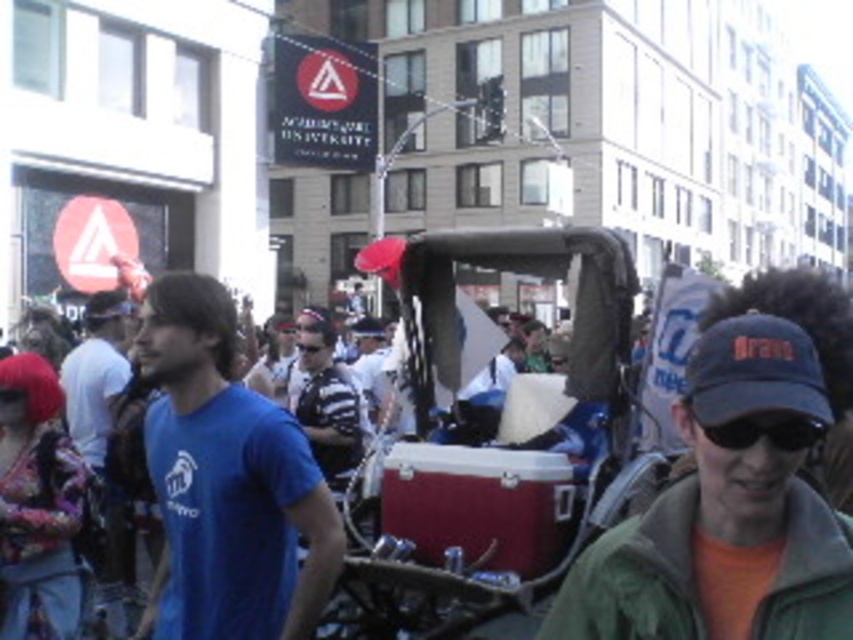
You are standing at the center of the street and see a point marked at coordinates (635,577). According to the scene, where is this point located?

The point is located on the green fuzzy jacket at lower right.